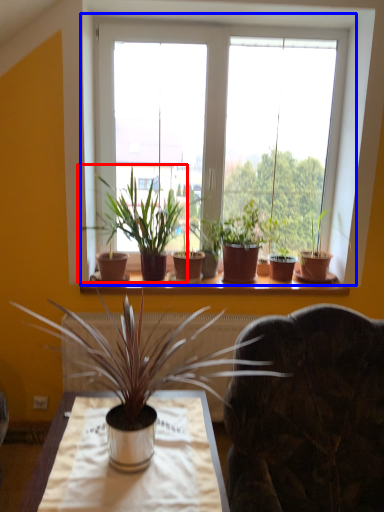
Question: Among these objects, which one is nearest to the camera, houseplant (highlighted by a red box) or window (highlighted by a blue box)?

Choices:
 (A) houseplant
 (B) window

Answer: (A)